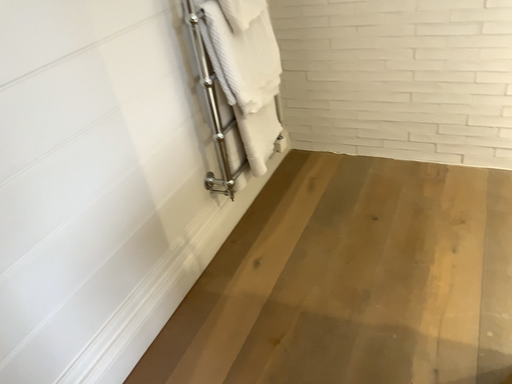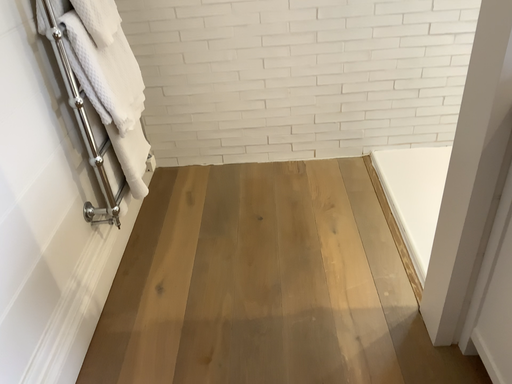
Question: Which way did the camera rotate in the video?

Choices:
 (A) rotated right
 (B) rotated left

Answer: (A)